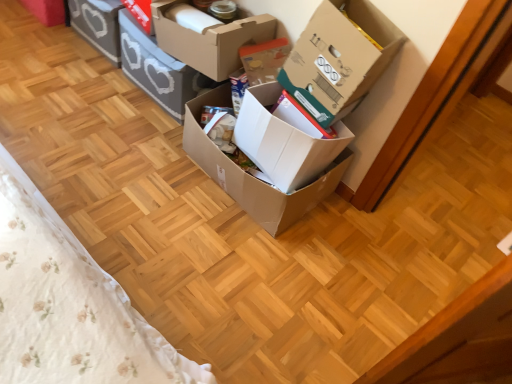
You are a GUI agent. You are given a task and a screenshot of the screen. Output one action in this format:
    pyautogui.click(x=<x>, y=<y>)
    Task: Click on the vacant space to the left of brown cardboard box at center, the third box positioned from the right
    The image size is (512, 384).
    Given the screenshot: What is the action you would take?
    pyautogui.click(x=130, y=159)